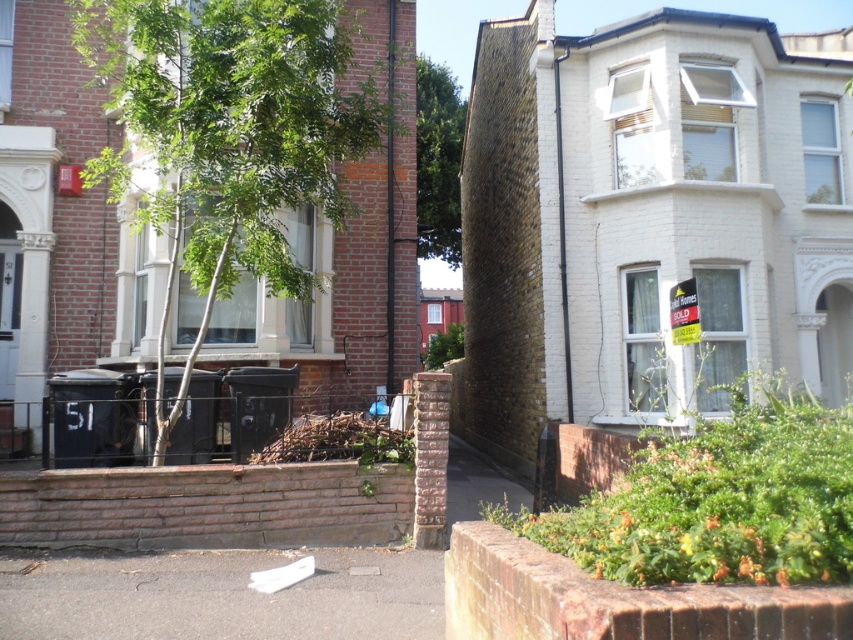
Between green leafy tree at left and white asphalt at lower center, which one has more height?

green leafy tree at left

Measure the distance between green leafy tree at left and white asphalt at lower center.

They are 9.68 feet apart.

This screenshot has height=640, width=853. I want to click on green leafy tree at left, so click(x=235, y=138).

This screenshot has width=853, height=640. Find the location of `green leafy tree at left`. green leafy tree at left is located at coordinates (235, 138).

Which of these two, white asphalt at lower center or green leafy tree at upper center, stands taller?

With more height is green leafy tree at upper center.

Does white asphalt at lower center have a lesser height compared to green leafy tree at upper center?

Yes, white asphalt at lower center is shorter than green leafy tree at upper center.

Who is more distant from viewer, (181, 595) or (456, 170)?

Positioned behind is point (456, 170).

In order to click on white asphalt at lower center in this screenshot , I will do `click(221, 595)`.

Who is more distant from viewer, (173, 259) or (442, 198)?

The point (442, 198) is more distant.

You are a GUI agent. You are given a task and a screenshot of the screen. Output one action in this format:
    pyautogui.click(x=<x>, y=<y>)
    Task: Click on the green leafy tree at left
    
    Given the screenshot: What is the action you would take?
    pyautogui.click(x=235, y=138)